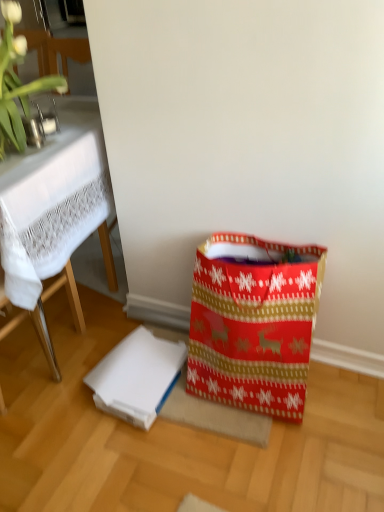
Image resolution: width=384 pixels, height=512 pixels. I want to click on vacant area to the right of white lace tablecloth at upper left, so click(x=81, y=365).